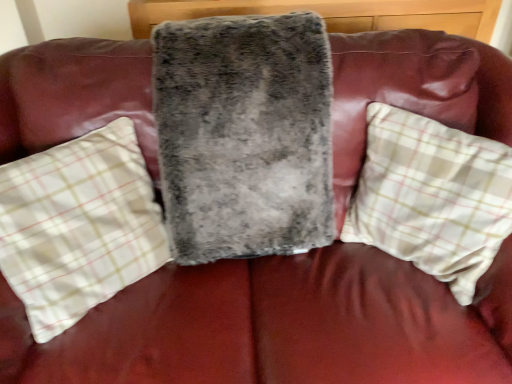
Question: Looking at their shapes, would you say white plaid pillow at right, which ranks as the first pillow in right-to-left order, is wider or thinner than fuzzy gray blanket at center?

Choices:
 (A) thin
 (B) wide

Answer: (A)

Question: Is white plaid pillow at right, which ranks as the first pillow in right-to-left order, spatially inside fuzzy gray blanket at center, or outside of it?

Choices:
 (A) inside
 (B) outside

Answer: (B)

Question: Which is farther from the white plaid pillow at right, which is the 2th pillow in left-to-right order?

Choices:
 (A) fuzzy gray blanket at center
 (B) fuzzy gray pillow at center, which ranks as the second pillow in right-to-left order

Answer: (B)

Question: Which object is the closest to the fuzzy gray blanket at center?

Choices:
 (A) fuzzy gray pillow at center, which ranks as the second pillow in right-to-left order
 (B) white plaid pillow at right, which ranks as the first pillow in right-to-left order

Answer: (A)